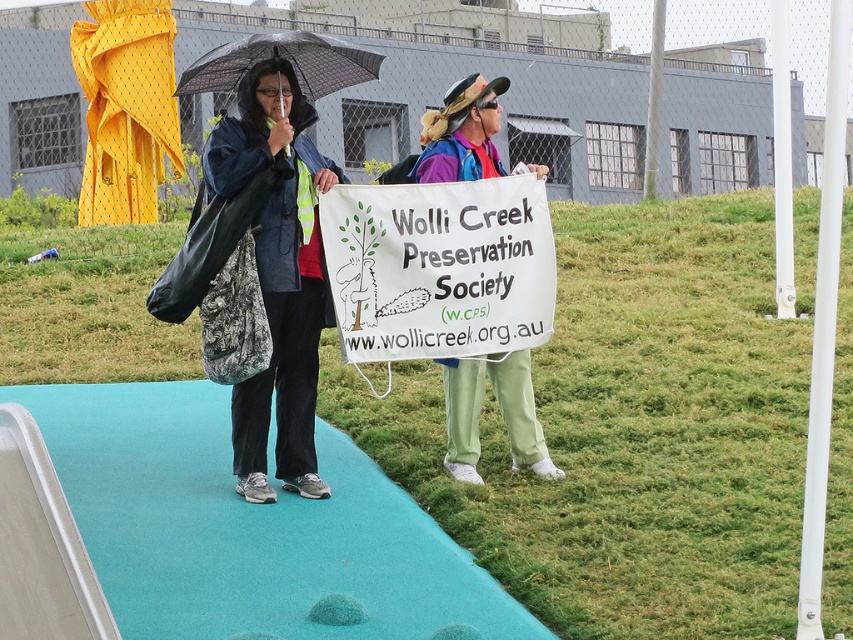
You are a photographer trying to capture a clear shot of the white paper sign at center and the matte blue jacket at center in the rain. Since the rain might blur the text on the sign, you want to ensure the sign is readable. Which object should you focus on first to avoid blurring caused by the rain?

The white paper sign at center has a larger width than the matte blue jacket at center, so focusing on the white paper sign at center first would ensure its text remains readable despite the rain.

You are a photographer trying to capture a clear image of the white paper sign at center and the green grass at center. Which object will appear larger in the photo?

The green grass at center will appear larger in the photo because it has a larger size compared to the white paper sign at center.

You are a photographer trying to capture a clear shot of the white paper sign at center and the matte blue jacket at center in the rain. Since the rain might blur the text on the sign, which object should you focus on first to ensure clarity?

The white paper sign at center is shorter than the matte blue jacket at center, so you should focus on the white paper sign at center first because it is closer to the camera and less affected by raindrops in the foreground.